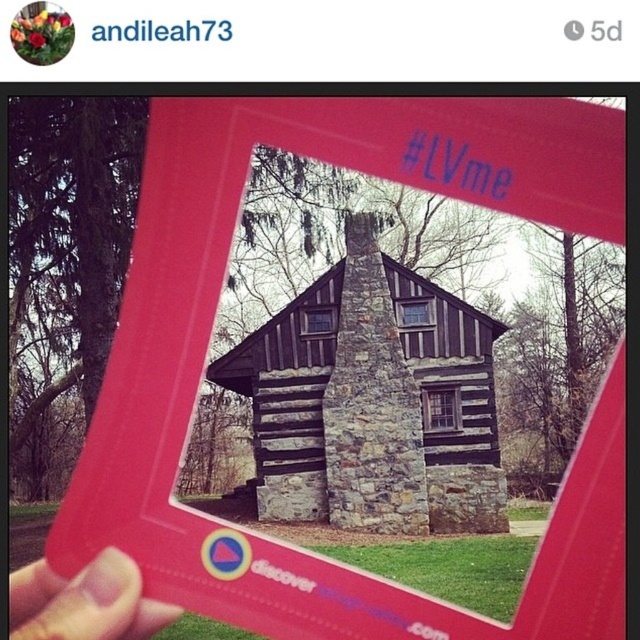
You are standing in front of the red photo frame holding the dark brown wood log cabin at center. If you want to take a photo of the cabin from a position closer to the center of the frame, should you move the frame to the left or right?

The dark brown wood log cabin at center is already positioned at the center of the frame at point (372, 401), so moving the frame would not be necessary. The cabin is already centered.